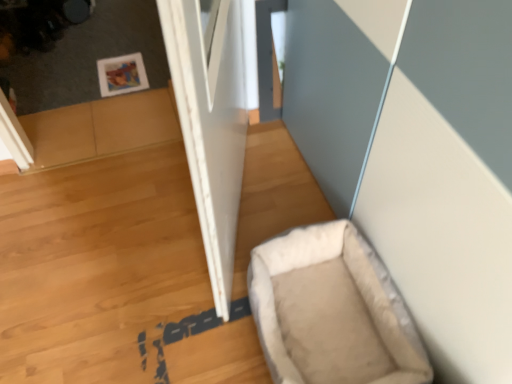
Find the location of a particular element. This screenshot has height=384, width=512. free spot to the left of white matte door at center is located at coordinates (109, 221).